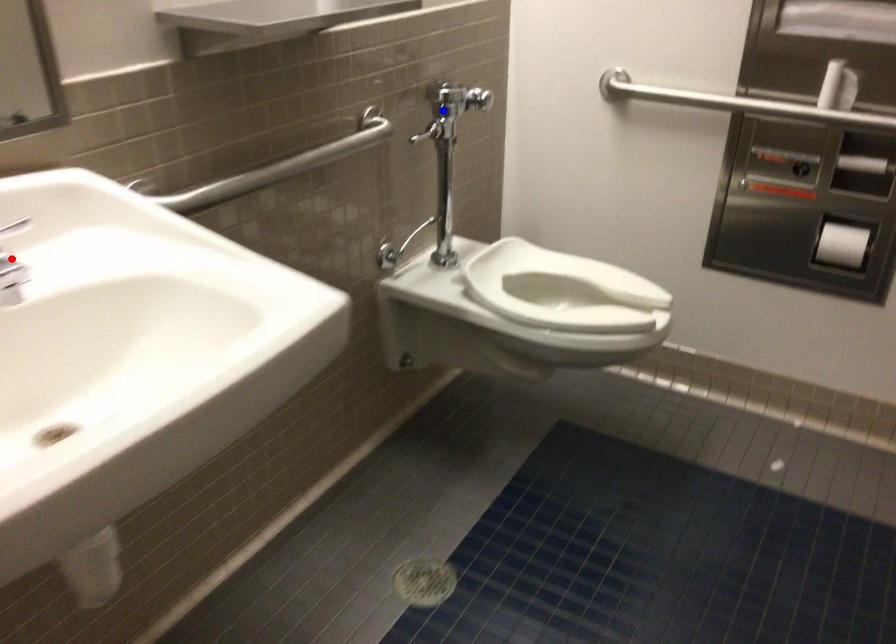
Question: Two points are marked on the image. Which point is closer to the camera?

Choices:
 (A) Blue point is closer.
 (B) Red point is closer.

Answer: (B)